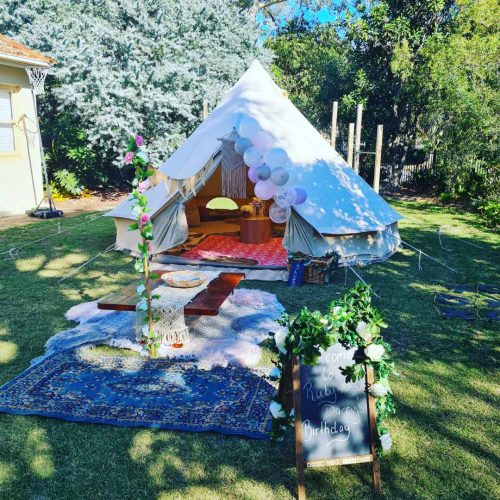
I want to click on blue rug, so click(x=175, y=410).